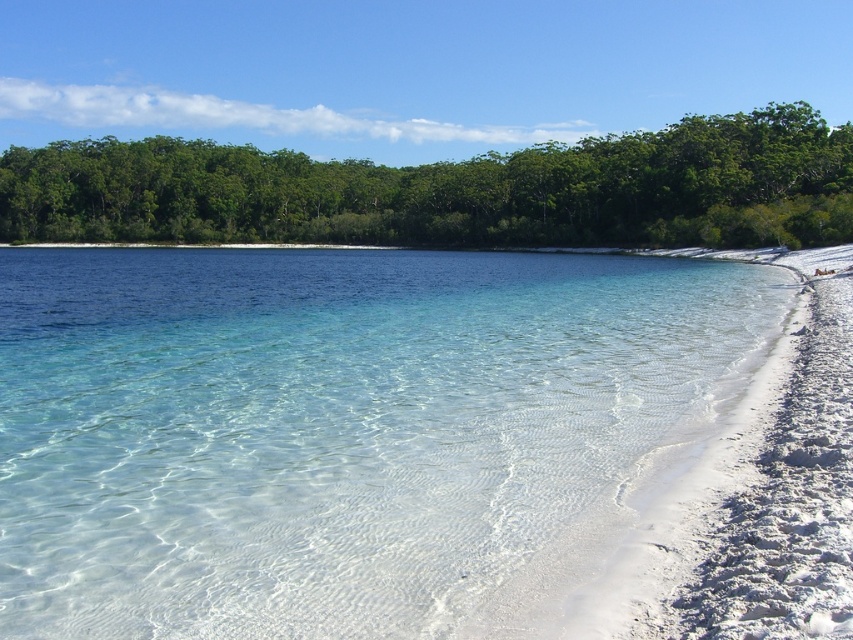
Question: Which object is farther from the camera taking this photo?

Choices:
 (A) clear water at center
 (B) green leafy trees at upper center

Answer: (B)

Question: From the image, what is the correct spatial relationship of clear water at center in relation to green leafy trees at upper center?

Choices:
 (A) above
 (B) below

Answer: (B)

Question: Does clear water at center have a larger size compared to green leafy trees at upper center?

Choices:
 (A) yes
 (B) no

Answer: (B)

Question: Which of the following is the farthest from the observer?

Choices:
 (A) clear water at center
 (B) green leafy trees at upper center

Answer: (B)

Question: Which object is farther from the camera taking this photo?

Choices:
 (A) clear water at center
 (B) green leafy trees at upper center

Answer: (B)

Question: Observing the image, what is the correct spatial positioning of clear water at center in reference to green leafy trees at upper center?

Choices:
 (A) above
 (B) below

Answer: (B)